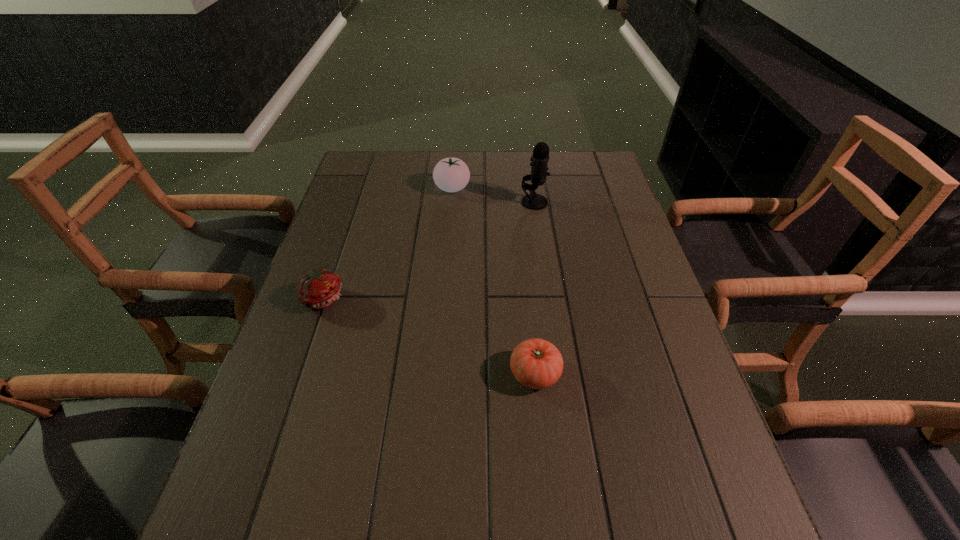
Find the location of a particular element. The width and height of the screenshot is (960, 540). vacant area that lies between the second tomato from right to left and the nearest tomato is located at coordinates (493, 281).

This screenshot has width=960, height=540. What are the coordinates of `vacant area that lies between the second nearest object and the rightmost tomato` in the screenshot? It's located at (429, 336).

At what (x,y) coordinates should I click in order to perform the action: click on free spot between the tallest tomato and the microphone. Please return your answer as a coordinate pair (x, y). Looking at the image, I should click on (493, 195).

Where is `free space between the third object from right to left and the rightmost tomato`? This screenshot has width=960, height=540. free space between the third object from right to left and the rightmost tomato is located at coordinates (493, 281).

Find the location of a particular element. The height and width of the screenshot is (540, 960). free point between the tallest tomato and the second nearest object is located at coordinates (388, 243).

The height and width of the screenshot is (540, 960). I want to click on free space between the tallest object and the leftmost tomato, so click(x=429, y=250).

You are a GUI agent. You are given a task and a screenshot of the screen. Output one action in this format:
    pyautogui.click(x=<x>, y=<y>)
    Task: Click on the vacant space that is in between the nearest object and the second farthest tomato
    The image size is (960, 540).
    Given the screenshot: What is the action you would take?
    pyautogui.click(x=429, y=336)

Locate an element on the screen. The image size is (960, 540). vacant space that's between the farthest tomato and the rightmost tomato is located at coordinates (493, 281).

Where is `the third closest object to the nearest object`? the third closest object to the nearest object is located at coordinates (450, 174).

Select which object appears as the third closest to the second tallest object. Please provide its 2D coordinates. Your answer should be formatted as a tuple, i.e. [(x, y)], where the tuple contains the x and y coordinates of a point satisfying the conditions above.

[(536, 363)]